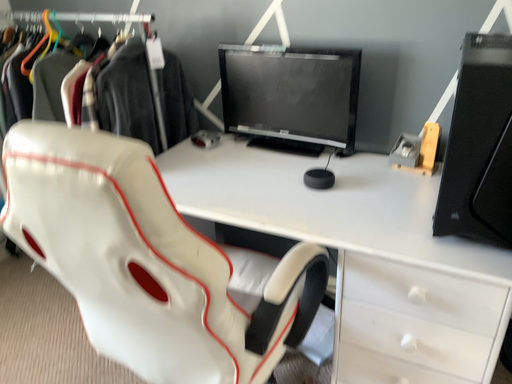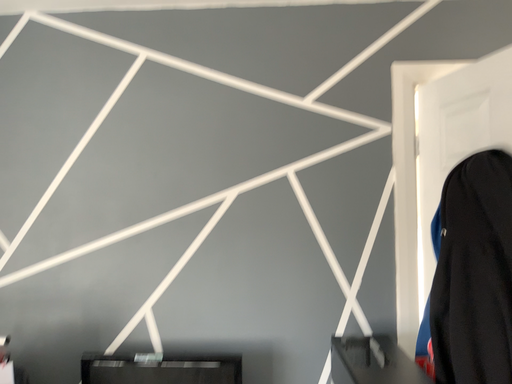
Question: Which way did the camera rotate in the video?

Choices:
 (A) rotated upward
 (B) rotated downward

Answer: (A)